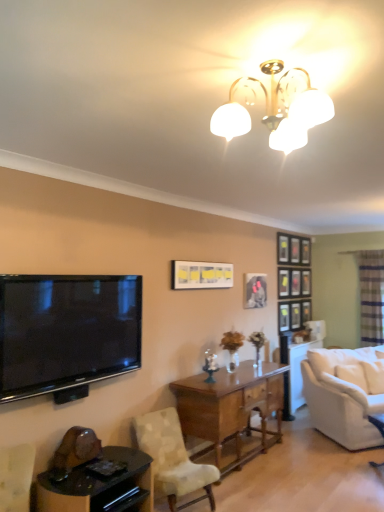
Identify the location of free point above matte yellow picture frame at center, which appears as the second picture frame when viewed from the back (from a real-world perspective). The image size is (384, 512). (206, 262).